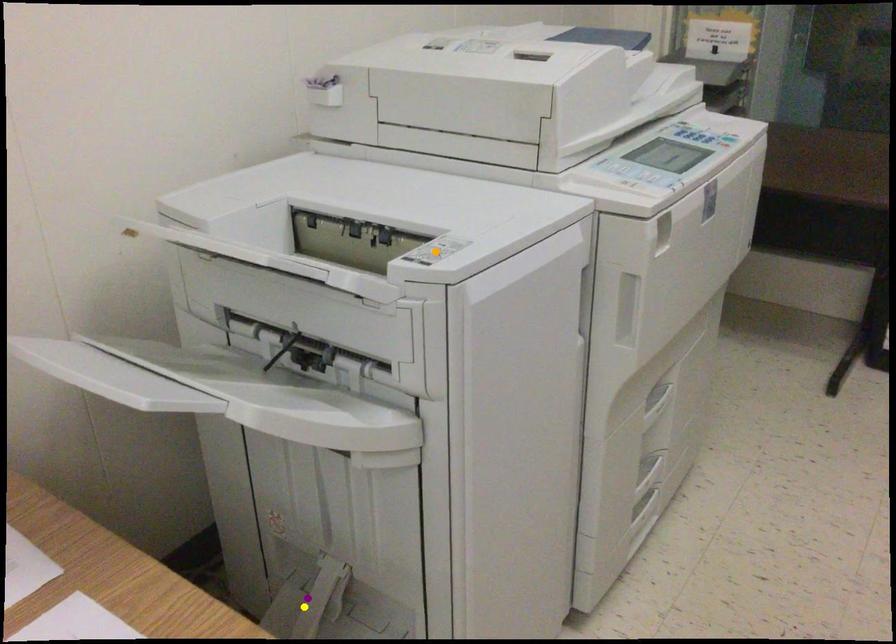
Order these from nearest to farthest:
yellow point | purple point | orange point

orange point
yellow point
purple point